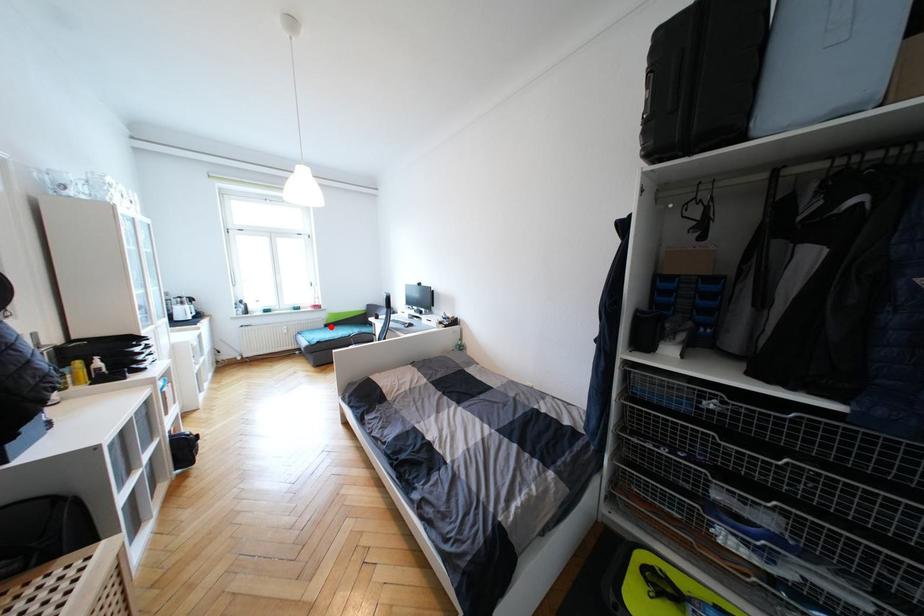
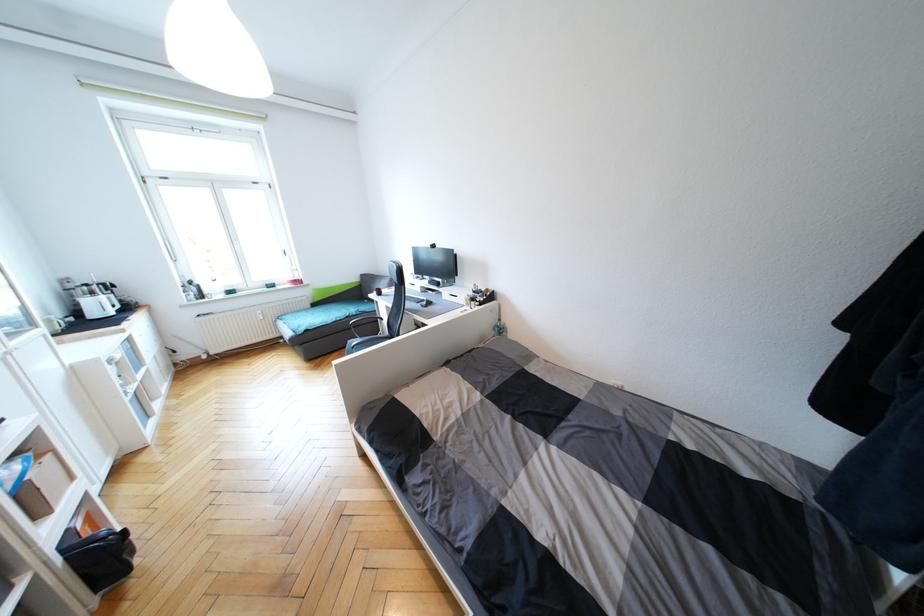
Find the pixel in the second image that matches the highlighted location in the first image.

(319, 306)